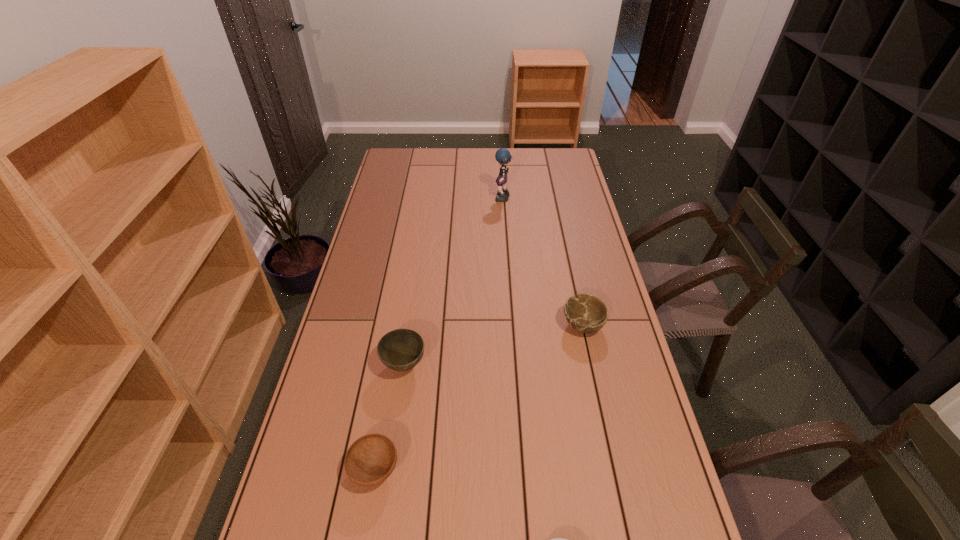
Where is `vacant space located 0.230m on the front-facing side of the rag doll`? This screenshot has width=960, height=540. vacant space located 0.230m on the front-facing side of the rag doll is located at coordinates (442, 199).

I want to click on vacant space located on the left of the second tallest object, so click(334, 365).

The height and width of the screenshot is (540, 960). Identify the location of vacant area situated 0.340m on the left of the fourth nearest object. (455, 325).

The width and height of the screenshot is (960, 540). Identify the location of vacant space situated 0.120m on the left of the second nearest object. (300, 469).

This screenshot has width=960, height=540. What are the coordinates of `object that is positioned at the left edge` in the screenshot? It's located at (370, 460).

At what (x,y) coordinates should I click in order to perform the action: click on object that is at the right edge. Please return your answer as a coordinate pair (x, y). The image size is (960, 540). Looking at the image, I should click on (587, 314).

What are the coordinates of `free space at the far edge` in the screenshot? It's located at (490, 151).

Find the location of `free space at the left edge of the desktop`. free space at the left edge of the desktop is located at coordinates (398, 203).

The width and height of the screenshot is (960, 540). I want to click on vacant space at the right edge of the desktop, so click(x=620, y=323).

Locate an element on the screen. vacant point at the far right corner is located at coordinates (549, 168).